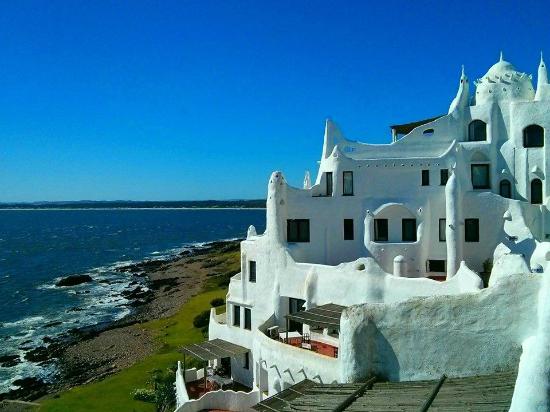
Where is `shades`? shades is located at coordinates (323, 310), (217, 346), (393, 393).